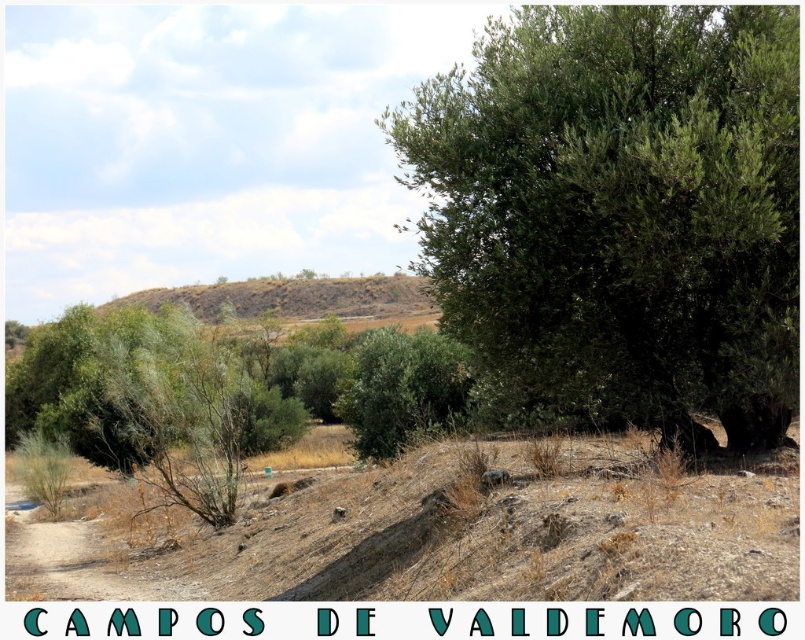
Based on the photo, you are a hiker planning to set up a tent in this rural landscape. You notice the green leafy tree at upper right and the brown dry soil at center. Which location would provide a more stable foundation for your tent? Please explain your reasoning based on the scene description.

The brown dry soil at center would provide a more stable foundation for the tent because the green leafy tree at upper right is thinner, making it less sturdy compared to the soil area.